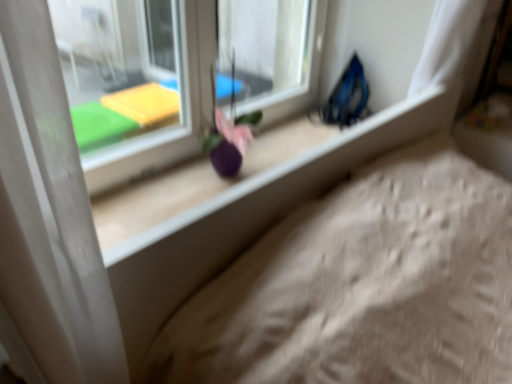
Question: Is matte plastic window at center to the right of purple matte flower at center from the viewer's perspective?

Choices:
 (A) yes
 (B) no

Answer: (B)

Question: Is matte plastic window at center turned away from purple matte flower at center?

Choices:
 (A) yes
 (B) no

Answer: (A)

Question: Is matte plastic window at center positioned in front of purple matte flower at center?

Choices:
 (A) no
 (B) yes

Answer: (B)

Question: Is matte plastic window at center not within purple matte flower at center?

Choices:
 (A) no
 (B) yes

Answer: (B)

Question: Is matte plastic window at center wider than purple matte flower at center?

Choices:
 (A) yes
 (B) no

Answer: (B)

Question: Is purple matte flower at center a part of matte plastic window at center?

Choices:
 (A) yes
 (B) no

Answer: (B)

Question: Is purple matte flower at center at the left side of matte plastic window at center?

Choices:
 (A) yes
 (B) no

Answer: (B)

Question: Does purple matte flower at center contain matte plastic window at center?

Choices:
 (A) no
 (B) yes

Answer: (A)

Question: Could you tell me if purple matte flower at center is turned towards matte plastic window at center?

Choices:
 (A) yes
 (B) no

Answer: (B)

Question: Are purple matte flower at center and matte plastic window at center far apart?

Choices:
 (A) no
 (B) yes

Answer: (A)

Question: Would you say purple matte flower at center is outside matte plastic window at center?

Choices:
 (A) yes
 (B) no

Answer: (A)

Question: Is purple matte flower at center thinner than matte plastic window at center?

Choices:
 (A) yes
 (B) no

Answer: (B)

Question: Is matte plastic window at center to the left or to the right of purple matte flower at center in the image?

Choices:
 (A) right
 (B) left

Answer: (B)